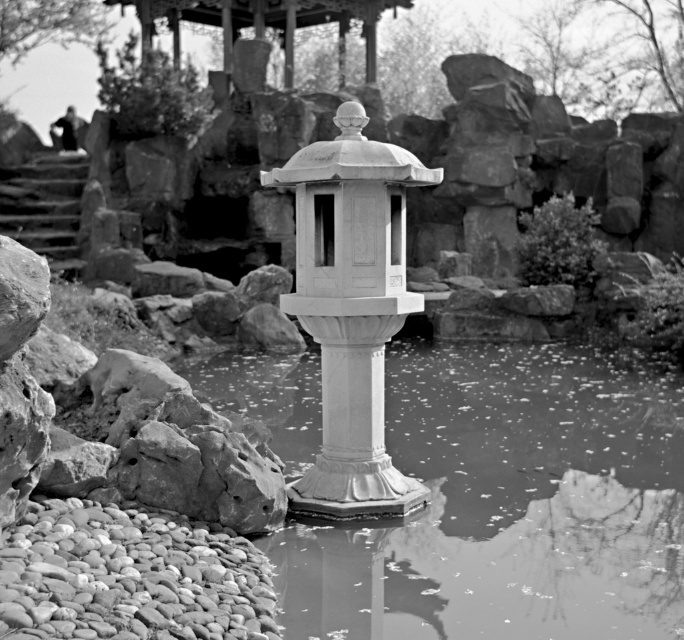
Who is taller, white stone lantern at center or smooth wooden gazebo at upper center?

With more height is white stone lantern at center.

The width and height of the screenshot is (684, 640). Identify the location of white stone lantern at center. (352, 308).

Is the position of translucent glass water at center less distant than that of smooth wooden gazebo at upper center?

That is True.

Identify the location of translucent glass water at center. [508, 506].

Is point (579, 452) farther from viewer compared to point (170, 1)?

No, (579, 452) is closer to viewer.

Find the location of a particular element. translucent glass water at center is located at coordinates (508, 506).

Is translucent glass water at center shorter than white stone lantern at center?

Indeed, translucent glass water at center has a lesser height compared to white stone lantern at center.

Who is more distant from viewer, (586, 458) or (402, 316)?

Positioned behind is point (586, 458).

At what (x,y) coordinates should I click in order to perform the action: click on translucent glass water at center. Please return your answer as a coordinate pair (x, y). This screenshot has width=684, height=640. Looking at the image, I should click on (508, 506).